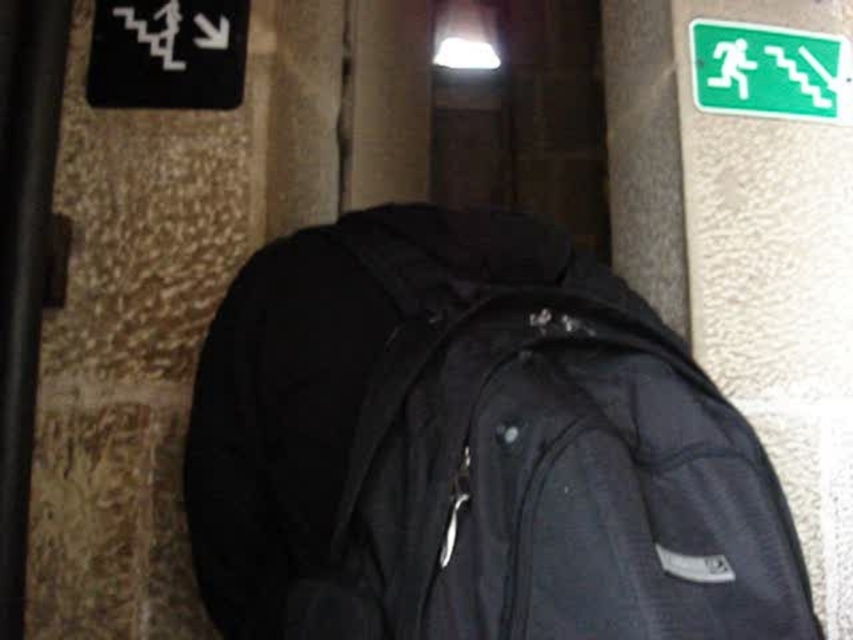
Is the position of black fabric backpack at center less distant than that of green plastic emergency exit sign at upper right?

Yes, black fabric backpack at center is in front of green plastic emergency exit sign at upper right.

Describe the element at coordinates (471, 449) in the screenshot. I see `black fabric backpack at center` at that location.

At what (x,y) coordinates should I click in order to perform the action: click on black fabric backpack at center. Please return your answer as a coordinate pair (x, y). This screenshot has width=853, height=640. Looking at the image, I should click on (471, 449).